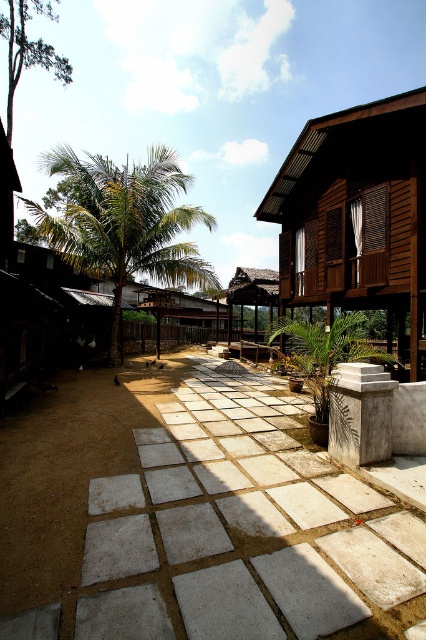
You are standing at the paved area in the foreground and want to take a photo of both the wooden building on the right and the dirt path on the left. Which point, point [305,134] or point [236,300], should you focus on to ensure both the wooden building and the dirt path are in clear focus?

You should focus on point [236,300] because it is farther from the camera than point [305,134]. Since the wooden building and dirt path are at different distances, focusing on the farther point will help keep both in focus.

You are a delivery person carrying a heavy box and need to walk from the dirt path on the left to the wooden house at right. The white concrete path at center is in between. Since the path is lower, will stepping onto it first help you avoid tripping?

The white concrete path at center has a lesser height compared to wooden house at right, so stepping onto it first may help avoid tripping as it is lower and provides a stable transition from the dirt path to the higher wooden house at right.